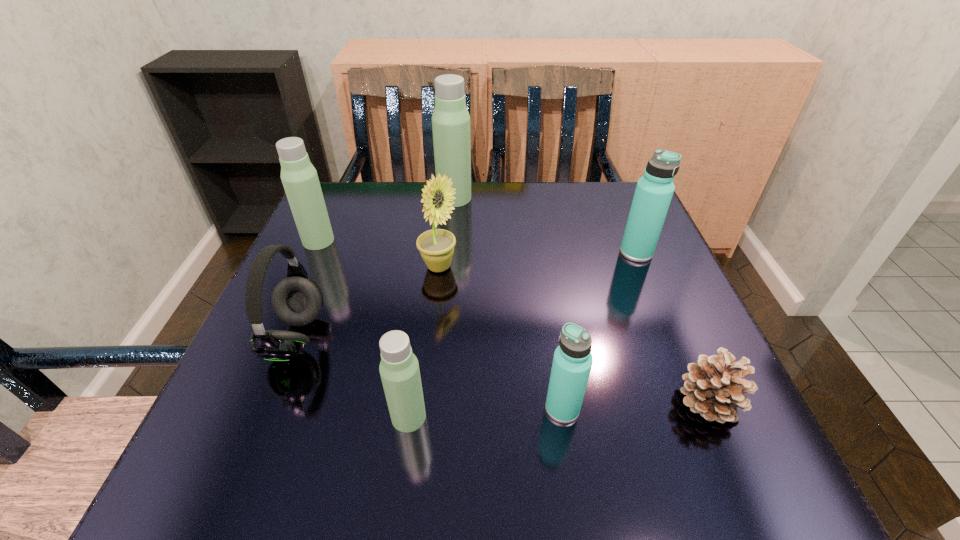
You are a GUI agent. You are given a task and a screenshot of the screen. Output one action in this format:
    pyautogui.click(x=<x>, y=<y>)
    Task: Click on the tallest object
    The width and height of the screenshot is (960, 540).
    Given the screenshot: What is the action you would take?
    pyautogui.click(x=450, y=120)

The width and height of the screenshot is (960, 540). Find the location of `the farthest object`. the farthest object is located at coordinates (450, 120).

Where is `the rightmost thermos bottle`? This screenshot has width=960, height=540. the rightmost thermos bottle is located at coordinates (654, 191).

Identify the location of the right aqua thermos bottle. (654, 191).

Locate an element on the screen. The image size is (960, 540). the leftmost thermos bottle is located at coordinates (299, 177).

Image resolution: width=960 pixels, height=540 pixels. In order to click on the leftmost light thermos bottle in this screenshot , I will do `click(299, 177)`.

Find the location of a particular element. This screenshot has width=960, height=540. yellow sunflower is located at coordinates (436, 246).

The height and width of the screenshot is (540, 960). I want to click on headset, so click(x=297, y=300).

What are the coordinates of `the smallest light thermos bottle` in the screenshot? It's located at click(399, 369).

Where is `the nearer aqua thermos bottle`? Image resolution: width=960 pixels, height=540 pixels. the nearer aqua thermos bottle is located at coordinates (572, 362).